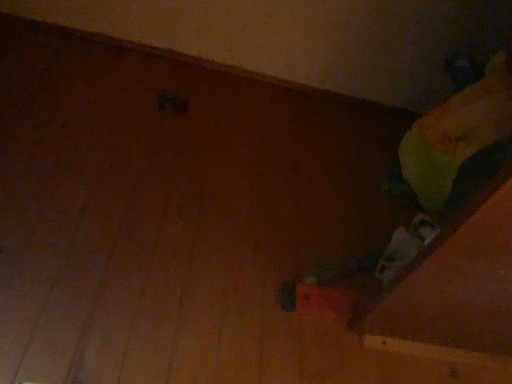
The height and width of the screenshot is (384, 512). What do you see at coordinates (359, 274) in the screenshot?
I see `rubberized red skateboard at center` at bounding box center [359, 274].

Locate an element on the screen. rubberized red skateboard at center is located at coordinates (359, 274).

Where is `rubberized red skateboard at center`? rubberized red skateboard at center is located at coordinates (359, 274).